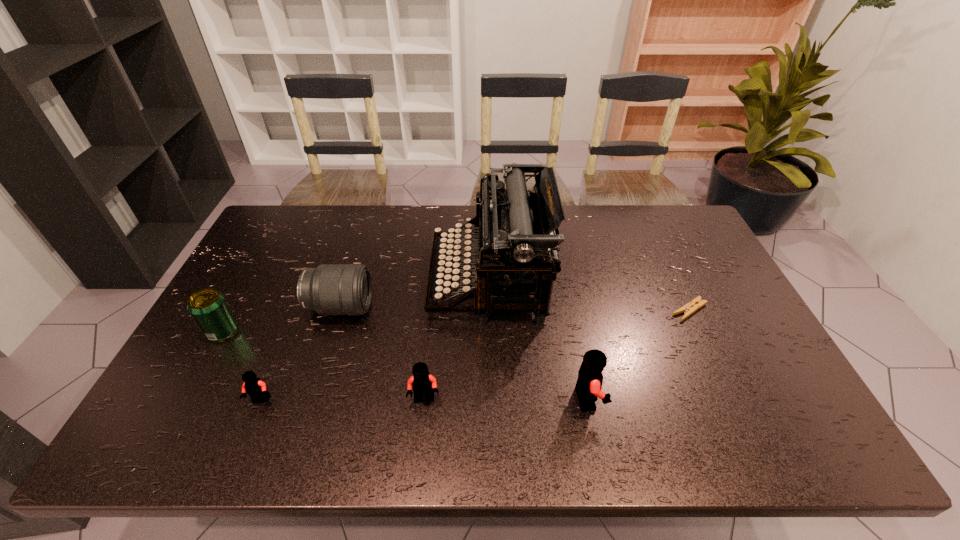
In the image, there is a desktop. Where is `free space at the far edge`? free space at the far edge is located at coordinates (358, 221).

The height and width of the screenshot is (540, 960). I want to click on free region at the near edge of the desktop, so click(462, 407).

Where is `vacant space at the left edge of the desktop`? This screenshot has width=960, height=540. vacant space at the left edge of the desktop is located at coordinates (238, 275).

The width and height of the screenshot is (960, 540). I want to click on vacant space at the right edge of the desktop, so click(x=728, y=330).

In the image, there is a desktop. At what (x,y) coordinates should I click in order to perform the action: click on blank space at the far right corner. Please return your answer as a coordinate pair (x, y). This screenshot has height=540, width=960. Looking at the image, I should click on (692, 222).

The height and width of the screenshot is (540, 960). I want to click on free spot between the tallest Lego and the leftmost object, so click(x=405, y=365).

The width and height of the screenshot is (960, 540). I want to click on vacant point located between the second object from right to left and the shortest Lego, so click(424, 399).

The width and height of the screenshot is (960, 540). Identify the location of free space between the sixth tallest object and the telephoto lens. (300, 354).

Identify the location of empty space between the leftmost object and the rightmost object. (456, 321).

Locate an element on the screen. This screenshot has height=540, width=960. unoccupied area between the beer can and the second tallest object is located at coordinates (405, 365).